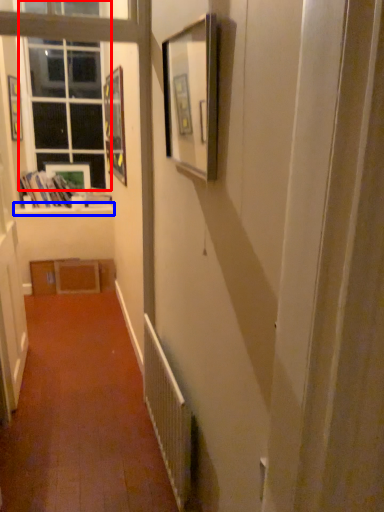
Question: Which object appears closest to the camera in this image, window (highlighted by a red box) or window sill (highlighted by a blue box)?

Choices:
 (A) window
 (B) window sill

Answer: (A)